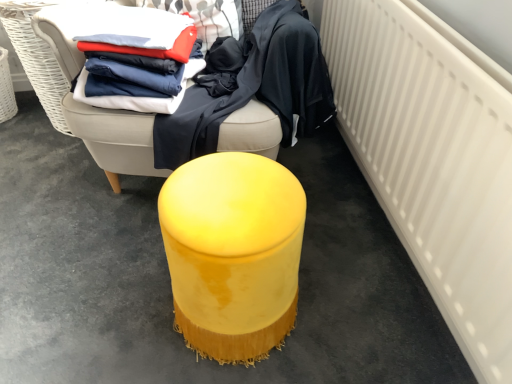
Question: Does velvet yellow ottoman at center, positioned as the first furniture in top-to-bottom order, have a lesser width compared to white matte radiator at right?

Choices:
 (A) yes
 (B) no

Answer: (B)

Question: Is velvet yellow ottoman at center, positioned as the first furniture in top-to-bottom order, turned away from white matte radiator at right?

Choices:
 (A) yes
 (B) no

Answer: (B)

Question: From a real-world perspective, does velvet yellow ottoman at center, positioned as the first furniture in top-to-bottom order, sit lower than white matte radiator at right?

Choices:
 (A) no
 (B) yes

Answer: (A)

Question: Is velvet yellow ottoman at center, which ranks as the second furniture in bottom-to-top order, positioned beyond the bounds of white matte radiator at right?

Choices:
 (A) yes
 (B) no

Answer: (A)

Question: Is the position of velvet yellow ottoman at center, positioned as the first furniture in top-to-bottom order, more distant than that of white matte radiator at right?

Choices:
 (A) yes
 (B) no

Answer: (A)

Question: In terms of width, does white matte radiator at right look wider or thinner when compared to velvet yellow ottoman at center, placed as the 1th furniture when sorted from bottom to top?

Choices:
 (A) wide
 (B) thin

Answer: (B)

Question: Considering the positions of white matte radiator at right and velvet yellow ottoman at center, placed as the 1th furniture when sorted from bottom to top, in the image, is white matte radiator at right bigger or smaller than velvet yellow ottoman at center, placed as the 1th furniture when sorted from bottom to top,?

Choices:
 (A) big
 (B) small

Answer: (A)

Question: From a real-world perspective, is white matte radiator at right positioned above or below velvet yellow ottoman at center, the second furniture when ordered from top to bottom?

Choices:
 (A) above
 (B) below

Answer: (A)

Question: Would you say white matte radiator at right is to the left or to the right of velvet yellow ottoman at center, placed as the 1th furniture when sorted from bottom to top, in the picture?

Choices:
 (A) left
 (B) right

Answer: (B)

Question: Looking at their shapes, would you say velvet yellow ottoman at center, placed as the 1th furniture when sorted from bottom to top, is wider or thinner than matte cotton shirts at upper left, placed as the first clothing when sorted from left to right?

Choices:
 (A) wide
 (B) thin

Answer: (B)

Question: Is velvet yellow ottoman at center, the second furniture when ordered from top to bottom, situated inside matte cotton shirts at upper left, placed as the first clothing when sorted from left to right, or outside?

Choices:
 (A) outside
 (B) inside

Answer: (A)

Question: Relative to matte cotton shirts at upper left, placed as the first clothing when sorted from left to right, is velvet yellow ottoman at center, the second furniture when ordered from top to bottom, in front or behind?

Choices:
 (A) front
 (B) behind

Answer: (A)

Question: Based on their positions, is velvet yellow ottoman at center, placed as the 1th furniture when sorted from bottom to top, located to the left or right of matte cotton shirts at upper left, placed as the first clothing when sorted from left to right?

Choices:
 (A) left
 (B) right

Answer: (B)

Question: Does point [x=110, y=99] appear closer or farther from the camera than point [x=251, y=79]?

Choices:
 (A) closer
 (B) farther

Answer: (A)

Question: In the image, is matte cotton shirts at upper left, placed as the first clothing when sorted from left to right, on the left side or the right side of matte blue fabric at center, the 1th clothing from the right?

Choices:
 (A) right
 (B) left

Answer: (B)